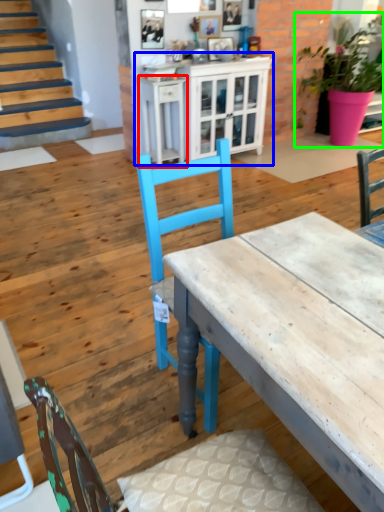
Question: Which object is positioned closest to table (highlighted by a red box)? Select from cabinetry (highlighted by a blue box) and houseplant (highlighted by a green box).

Choices:
 (A) cabinetry
 (B) houseplant

Answer: (A)